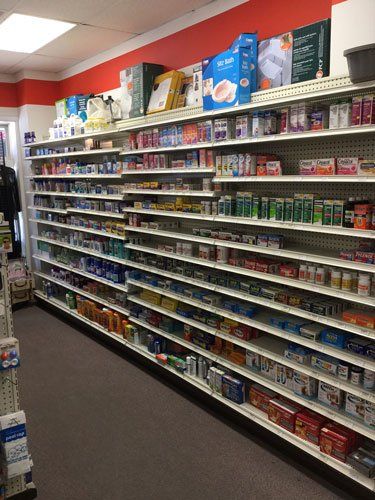
Image resolution: width=375 pixels, height=500 pixels. Find the location of `top shelf`. top shelf is located at coordinates (156, 117).